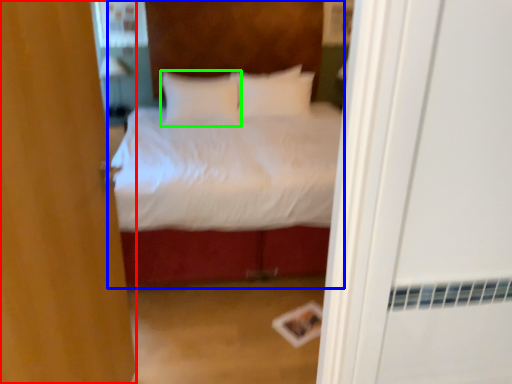
Question: Which object is the closest to the door (highlighted by a red box)? Choose among these: bed (highlighted by a blue box) or pillow (highlighted by a green box).

Choices:
 (A) bed
 (B) pillow

Answer: (B)